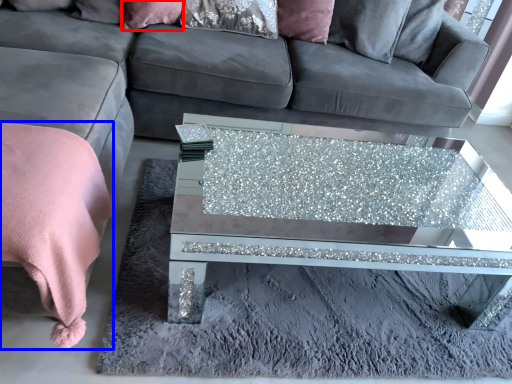
Question: Which of the following is the closest to the observer, pillow (highlighted by a red box) or blanket (highlighted by a blue box)?

Choices:
 (A) pillow
 (B) blanket

Answer: (B)